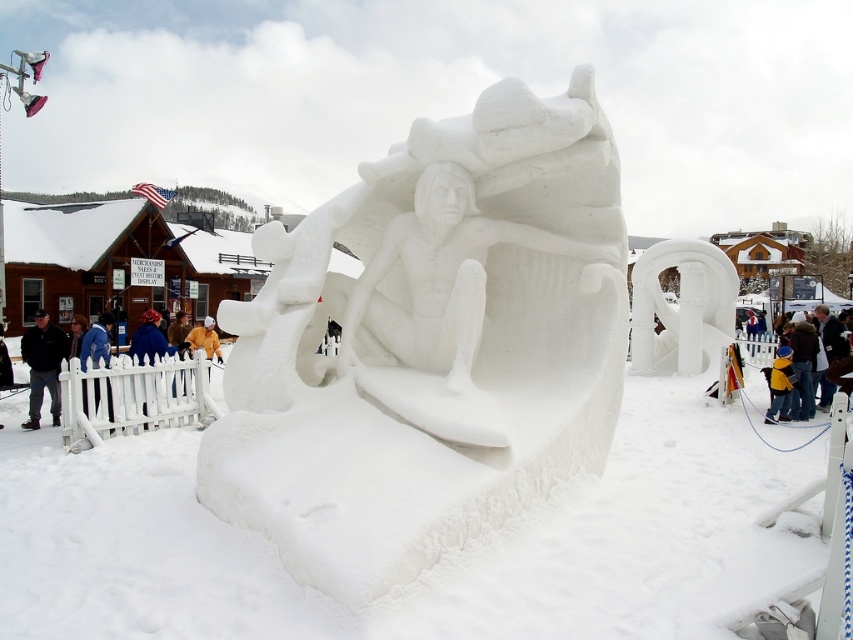
Question: Estimate the real-world distances between objects in this image. Which object is farther from the blue woolen hat at left?

Choices:
 (A) yellow jacket at lower right
 (B) white snow sculpture at center
 (C) dark gray jacket at left

Answer: (A)

Question: Considering the real-world distances, which object is closest to the white matte snow sculpture at left?

Choices:
 (A) white snow sculpture at center
 (B) yellow jacket at lower right
 (C) blue woolen hat at left
 (D) dark gray jacket at left

Answer: (C)

Question: Which is farther from the dark gray jacket at left?

Choices:
 (A) white matte snow sculpture at left
 (B) blue woolen hat at left

Answer: (A)

Question: Observing the image, what is the correct spatial positioning of white snow sculpture at center in reference to dark gray jacket at left?

Choices:
 (A) right
 (B) left

Answer: (A)

Question: Does white matte snow sculpture at left appear under dark gray jacket at left?

Choices:
 (A) no
 (B) yes

Answer: (B)

Question: Is white snow sculpture at center positioned before white matte snow sculpture at left?

Choices:
 (A) no
 (B) yes

Answer: (B)